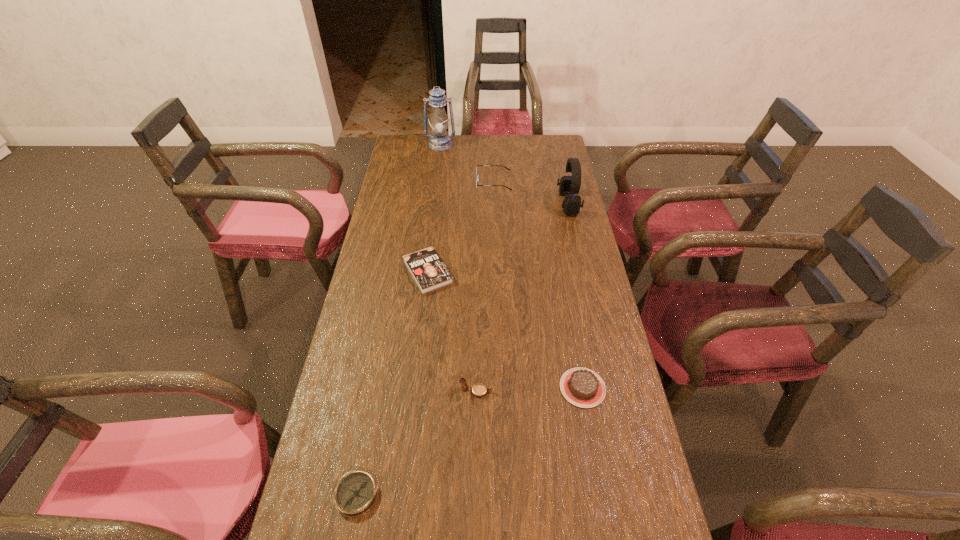
Identify the location of the nearer compass. Image resolution: width=960 pixels, height=540 pixels. (356, 492).

Find the location of `free spot located on the front-facing side of the farthest object`. free spot located on the front-facing side of the farthest object is located at coordinates coord(435,195).

Find the location of a particular element. The height and width of the screenshot is (540, 960). vacant space located 0.370m on the headband of the headset is located at coordinates (460, 204).

Find the location of a particular element. This screenshot has width=960, height=540. blank area located on the headband of the headset is located at coordinates (521, 204).

This screenshot has width=960, height=540. What are the coordinates of `free space located 0.390m on the headband of the headset` in the screenshot? It's located at (455, 204).

The image size is (960, 540). Find the location of `free space located 0.070m on the lenses of the spectacles`. free space located 0.070m on the lenses of the spectacles is located at coordinates (459, 183).

The height and width of the screenshot is (540, 960). I want to click on vacant space located on the lenses of the spectacles, so click(x=464, y=183).

Locate an element on the screen. Image resolution: width=960 pixels, height=540 pixels. blank area located on the lenses of the spectacles is located at coordinates (408, 183).

Identify the location of vacant space situated on the face of the taller compass. (514, 392).

Identify the location of vacant space located on the front of the fifth tallest object. (598, 471).